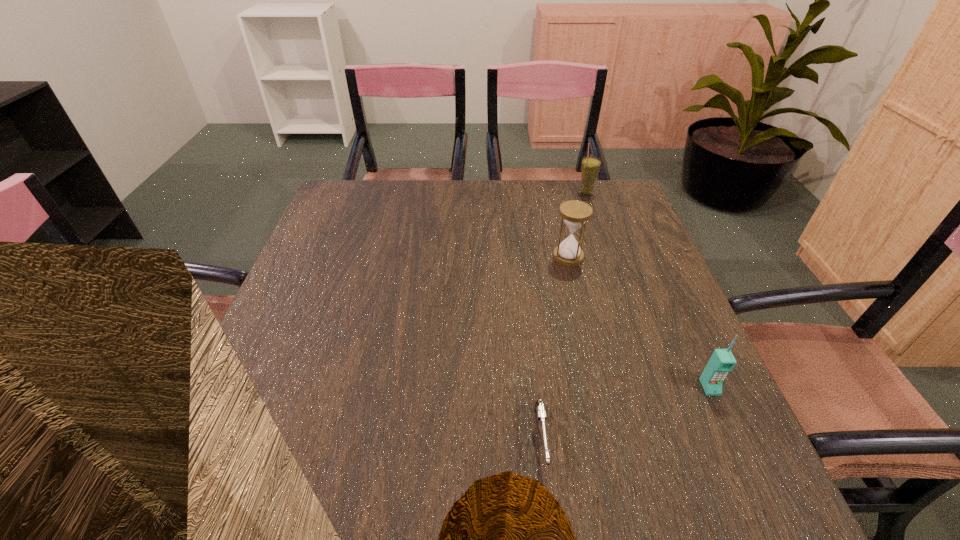
Where is `object that is the third closest to the shortest object`? object that is the third closest to the shortest object is located at coordinates (590, 166).